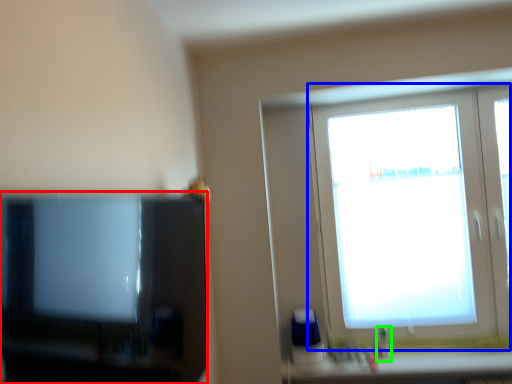
Question: Estimate the real-world distances between objects in this image. Which object is closer to television (highlighted by a red box), window (highlighted by a blue box) or toiletry (highlighted by a green box)?

Choices:
 (A) window
 (B) toiletry

Answer: (A)